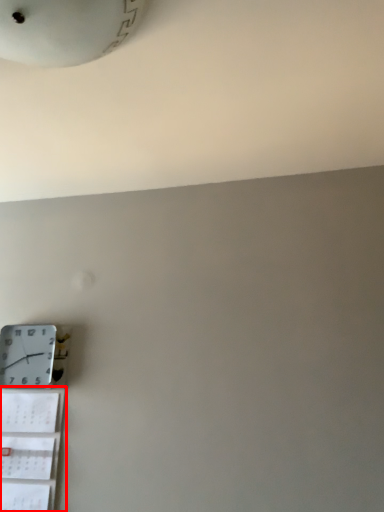
Question: From the image's perspective, where is shelf (annotated by the red box) located in relation to wall clock in the image?

Choices:
 (A) above
 (B) below

Answer: (B)